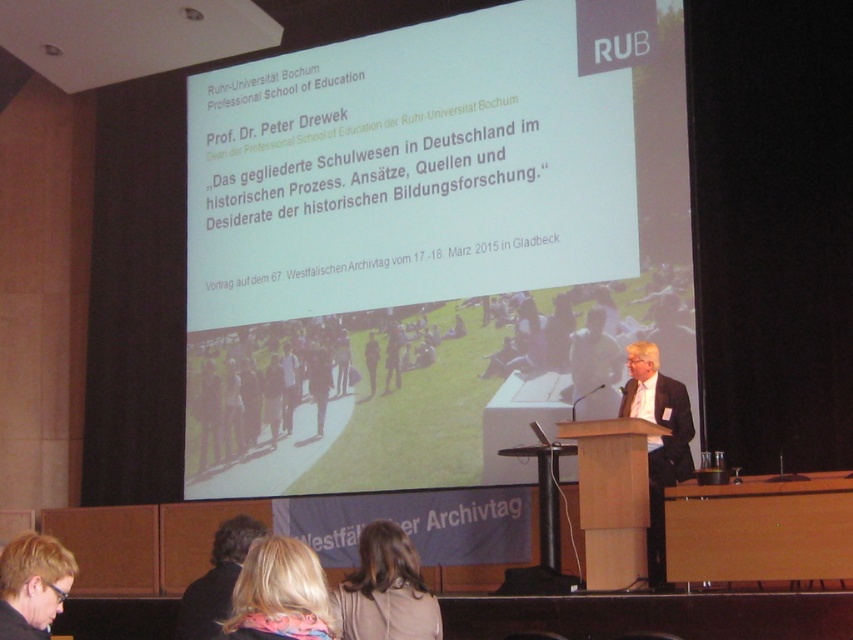
Question: Among these objects, which one is farthest from the camera?

Choices:
 (A) light brown leather jacket at center
 (B) blonde hair scarf at lower center
 (C) blonde hair at lower center

Answer: (A)

Question: Which object is the farthest from the blonde hair scarf at lower center?

Choices:
 (A) blonde hair at lower center
 (B) white paper at upper center
 (C) light brown leather jacket at center

Answer: (C)

Question: In this image, where is blonde hair at lower left located relative to dark brown hair at lower center?

Choices:
 (A) below
 (B) above

Answer: (B)

Question: Which of these objects is positioned farthest from the white paper at upper center?

Choices:
 (A) dark brown hair at lower center
 (B) light brown leather jacket at center
 (C) blonde hair at lower center
 (D) light brown suit at center

Answer: (A)

Question: Does blonde hair at lower center appear on the right side of dark brown hair at lower center?

Choices:
 (A) yes
 (B) no

Answer: (A)

Question: Does blonde hair scarf at lower center appear over dark brown hair at lower center?

Choices:
 (A) no
 (B) yes

Answer: (B)